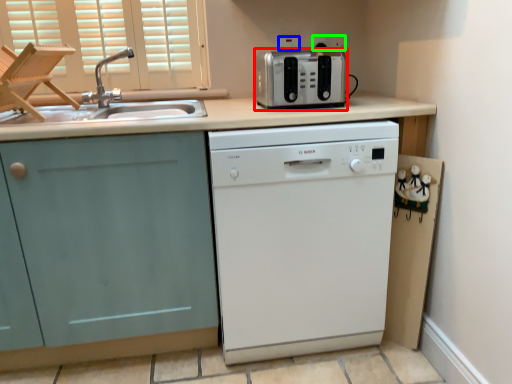
Question: Which object is the closest to the kitchen appliance (highlighted by a red box)? Choose among these: electric outlet (highlighted by a blue box) or electric outlet (highlighted by a green box).

Choices:
 (A) electric outlet
 (B) electric outlet

Answer: (B)